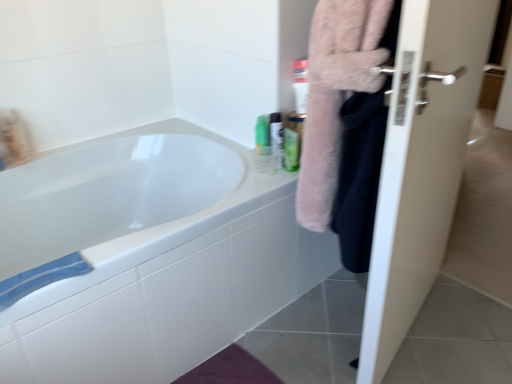
I want to click on vacant space to the left of green matte bottle at upper right, placed as the fourth mouthwash when sorted from left to right, so click(260, 165).